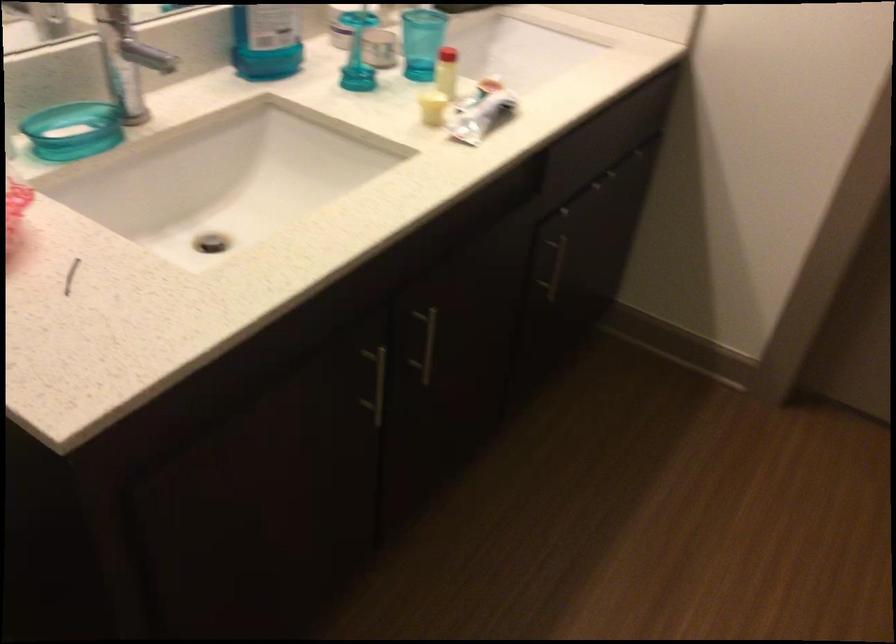
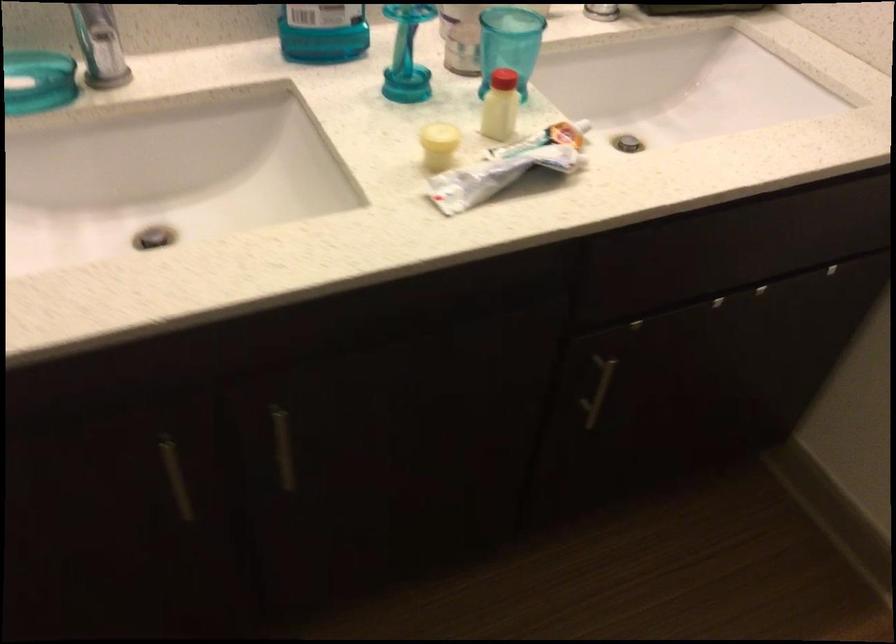
In the second image, find the point that corresponds to [480,118] in the first image.

(495, 176)